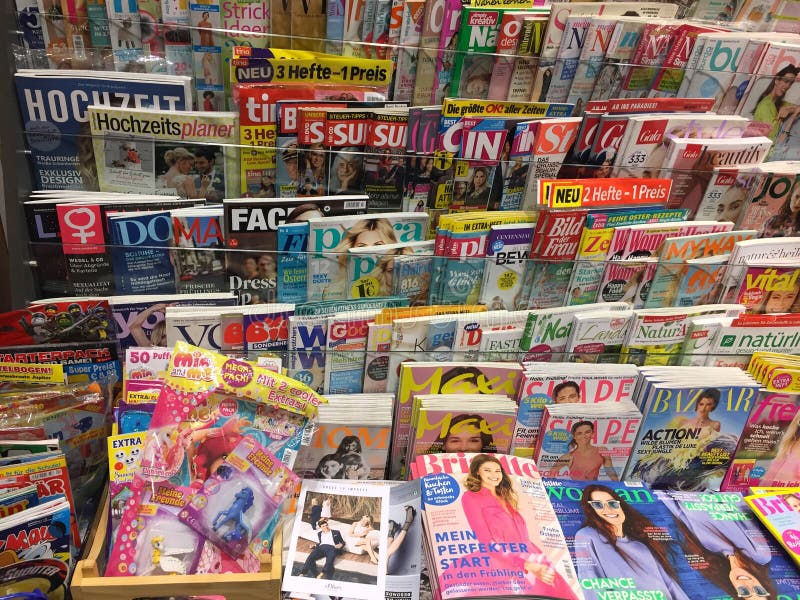
Locate an element on the screen. Image resolution: width=800 pixels, height=600 pixels. space to the left of the magazine racks is located at coordinates (13, 168).